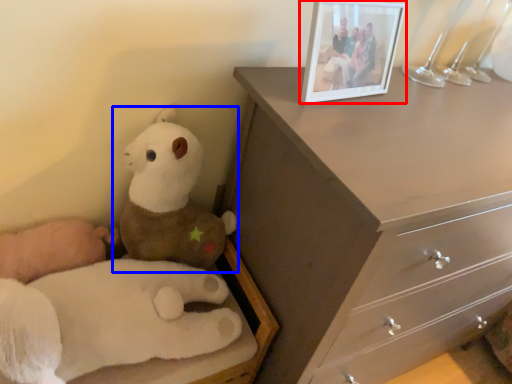
Question: Among these objects, which one is nearest to the camera, picture frame (highlighted by a red box) or toy (highlighted by a blue box)?

Choices:
 (A) picture frame
 (B) toy

Answer: (A)